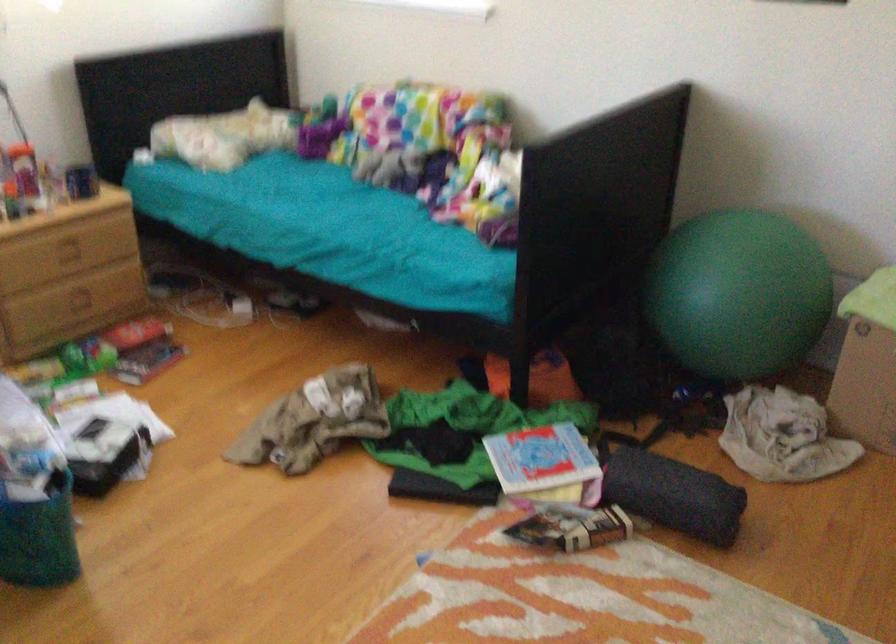
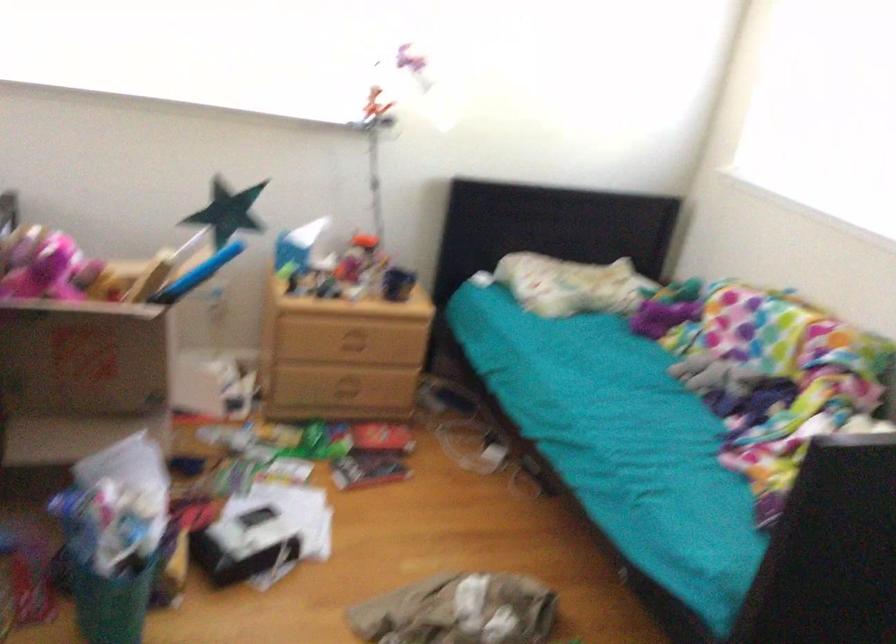
Locate, in the second image, the point that corresponds to the point at 73,251 in the first image.

(352, 343)